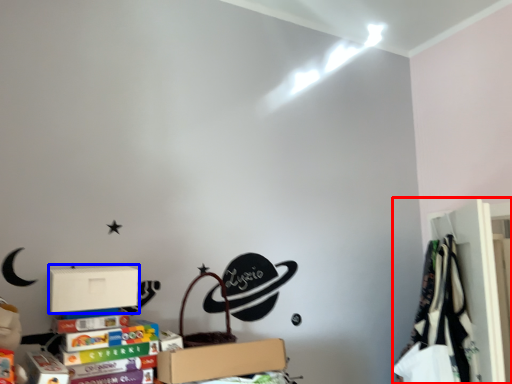
Question: Which object appears farthest to the camera in this image, closet (highlighted by a red box) or cardboard box (highlighted by a blue box)?

Choices:
 (A) closet
 (B) cardboard box

Answer: (A)